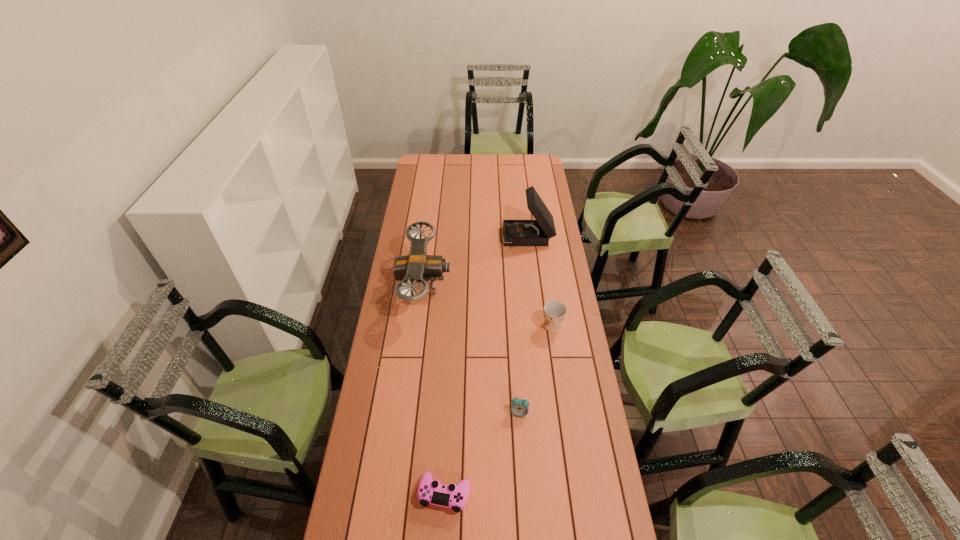
Locate an element on the screen. This screenshot has height=540, width=960. free space between the second tallest object and the tallest object is located at coordinates (476, 262).

Identify the location of the third closest object to the Dixie cup. The width and height of the screenshot is (960, 540). (537, 232).

The width and height of the screenshot is (960, 540). I want to click on object that is the third closest to the third shortest object, so click(x=537, y=232).

Find the location of a particular element. blank space that satisfies the following two spatial constraints: 1. on the front-facing side of the phonograph_record; 2. on the back side of the Dixie cup is located at coordinates (539, 326).

Locate an element on the screen. This screenshot has width=960, height=540. vacant space that satisfies the following two spatial constraints: 1. on the back side of the third tallest object; 2. on the front-facing side of the tallest object is located at coordinates (540, 239).